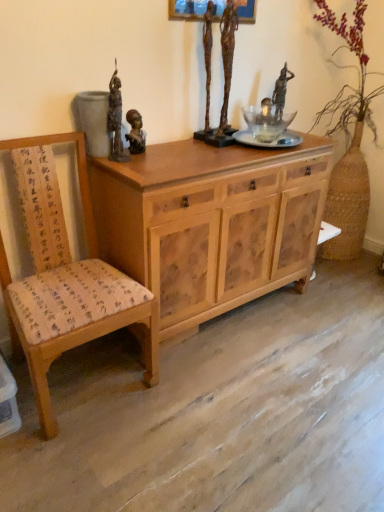
Where is `vacant space in front of natural wood cabinet at center`? vacant space in front of natural wood cabinet at center is located at coordinates (239, 406).